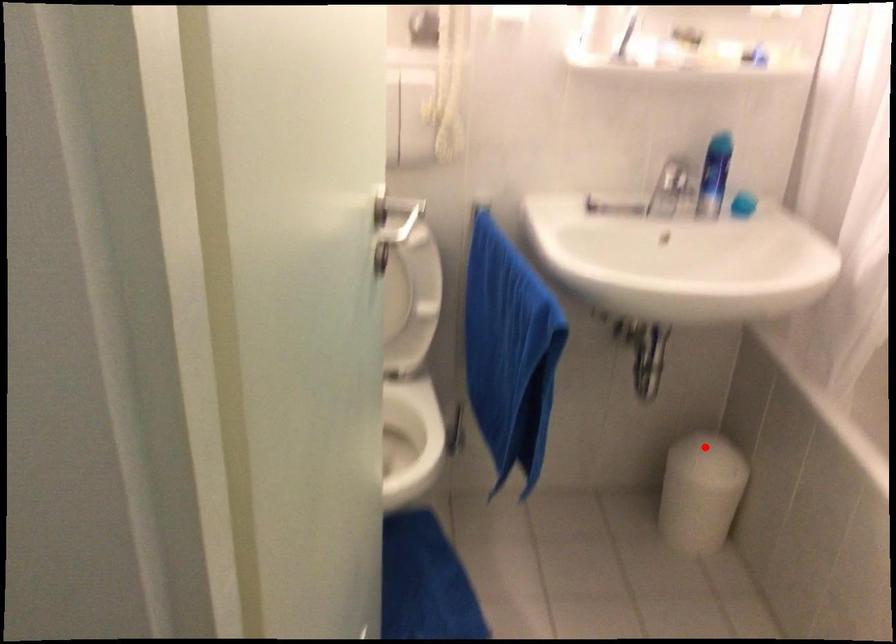
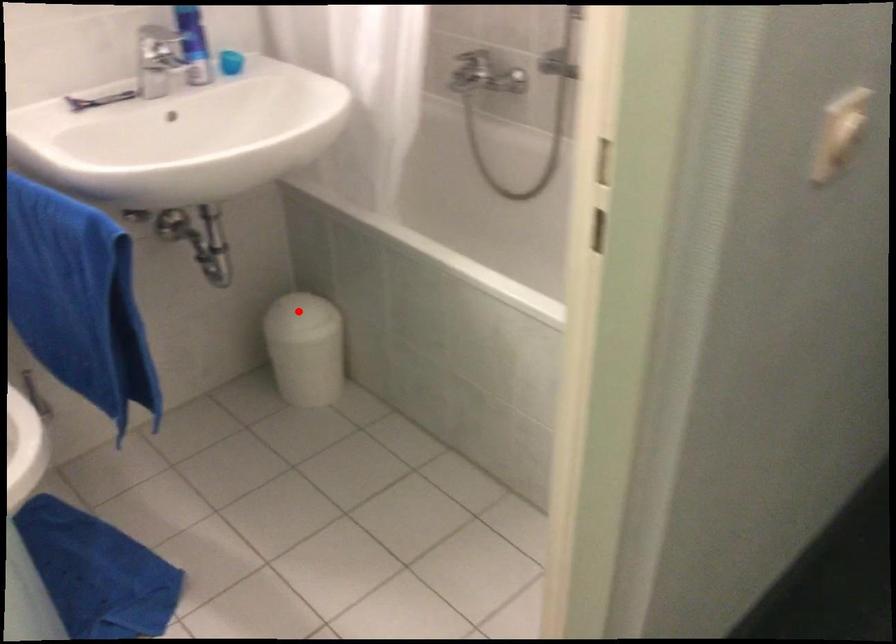
I am providing you with two images of the same scene from different viewpoints. A red point is marked on the first image and another point is marked on the second image. Is the red point in image1 aligned with the point shown in image2?

Yes